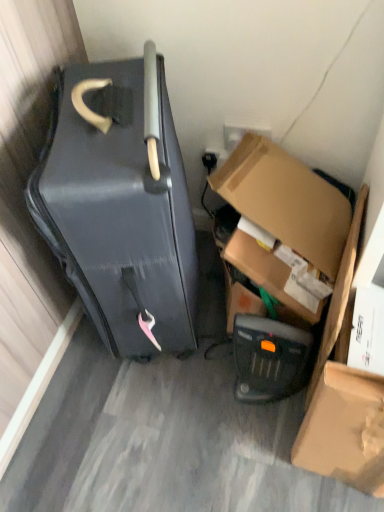
Find the location of a particular element. The image size is (384, 512). matte brown cardboard box at lower right is located at coordinates (341, 429).

You are a GUI agent. You are given a task and a screenshot of the screen. Output one action in this format:
    pyautogui.click(x=<x>, y=<y>)
    Task: Click on the cardboard box at lower right
    The height and width of the screenshot is (512, 384).
    Given the screenshot: What is the action you would take?
    pyautogui.click(x=286, y=200)

Image resolution: width=384 pixels, height=512 pixels. Describe the element at coordinates (286, 200) in the screenshot. I see `cardboard box at lower right` at that location.

You are a GUI agent. You are given a task and a screenshot of the screen. Output one action in this format:
    pyautogui.click(x=<x>, y=<y>)
    Task: Click on the matte black suitcase at left
    The height and width of the screenshot is (512, 384).
    Given the screenshot: What is the action you would take?
    pyautogui.click(x=120, y=205)

From a real-world perspective, is matte brown cardboard box at lower right above or below cardboard box at lower right?

From a real-world perspective, matte brown cardboard box at lower right is physically below cardboard box at lower right.

Is matte brown cardboard box at lower right positioned before cardboard box at lower right?

Yes.

How different are the orientations of matte brown cardboard box at lower right and cardboard box at lower right in degrees?

1.91 degrees.

You are a GUI agent. You are given a task and a screenshot of the screen. Output one action in this format:
    pyautogui.click(x=<x>, y=<y>)
    Task: Click on the cardboard box located in front of the cardboard box at lower right
    This screenshot has height=512, width=384.
    Given the screenshot: What is the action you would take?
    pyautogui.click(x=341, y=429)

From a real-world perspective, who is located higher, cardboard box at lower right or matte brown cardboard box at lower right?

In real-world perspective, cardboard box at lower right is above.

In the image, is cardboard box at lower right positioned in front of or behind matte brown cardboard box at lower right?

cardboard box at lower right is positioned farther from the viewer than matte brown cardboard box at lower right.

Would you say cardboard box at lower right contains matte brown cardboard box at lower right?

No, matte brown cardboard box at lower right is not surrounded by cardboard box at lower right.

Considering the relative sizes of cardboard box at lower right and matte brown cardboard box at lower right in the image provided, is cardboard box at lower right bigger than matte brown cardboard box at lower right?

Correct, cardboard box at lower right is larger in size than matte brown cardboard box at lower right.

From a real-world perspective, between matte brown cardboard box at lower right and matte black suitcase at left, who is vertically higher?

matte black suitcase at left.

Consider the image. From the image's perspective, is matte brown cardboard box at lower right positioned above or below matte black suitcase at left?

Based on their image positions, matte brown cardboard box at lower right is located beneath matte black suitcase at left.

Is matte brown cardboard box at lower right taller than matte black suitcase at left?

In fact, matte brown cardboard box at lower right may be shorter than matte black suitcase at left.

Does matte brown cardboard box at lower right appear on the right side of matte black suitcase at left?

Indeed, matte brown cardboard box at lower right is positioned on the right side of matte black suitcase at left.

Is matte brown cardboard box at lower right aimed at black plastic heater at lower center?

No, matte brown cardboard box at lower right is not oriented towards black plastic heater at lower center.

Does point (311, 400) appear closer or farther from the camera than point (290, 383)?

Point (311, 400) appears to be closer to the viewer than point (290, 383).

Considering the positions of objects matte brown cardboard box at lower right and black plastic heater at lower center in the image provided, who is more to the left, matte brown cardboard box at lower right or black plastic heater at lower center?

Positioned to the left is black plastic heater at lower center.

Identify the location of appliance on the left side of matte brown cardboard box at lower right. This screenshot has height=512, width=384. (269, 358).

Would you say matte black suitcase at left is to the left or to the right of cardboard box at lower right in the picture?

From the image, it's evident that matte black suitcase at left is to the left of cardboard box at lower right.

Is matte black suitcase at left not near cardboard box at lower right?

They are positioned close to each other.

How different are the orientations of matte black suitcase at left and cardboard box at lower right in degrees?

The angle between the facing direction of matte black suitcase at left and the facing direction of cardboard box at lower right is 110 degrees.

From the image's perspective, which is below, matte black suitcase at left or cardboard box at lower right?

cardboard box at lower right, from the image's perspective.

This screenshot has width=384, height=512. Identify the location of box that is behind the matte black suitcase at left. (286, 200).

How different are the orientations of cardboard box at lower right and matte black suitcase at left in degrees?

There is a 110-degree angle between the facing directions of cardboard box at lower right and matte black suitcase at left.

Does cardboard box at lower right appear on the right side of matte black suitcase at left?

Yes.

Considering the sizes of cardboard box at lower right and matte black suitcase at left in the image, is cardboard box at lower right taller or shorter than matte black suitcase at left?

cardboard box at lower right is shorter than matte black suitcase at left.

Does black plastic heater at lower center appear on the right side of matte brown cardboard box at lower right?

No.

Looking at this image, considering the relative sizes of black plastic heater at lower center and matte brown cardboard box at lower right in the image provided, is black plastic heater at lower center taller than matte brown cardboard box at lower right?

Incorrect, the height of black plastic heater at lower center is not larger of that of matte brown cardboard box at lower right.

Locate an element on the screen. This screenshot has width=384, height=512. cardboard box that is on the right side of cardboard box at lower right is located at coordinates (341, 429).

In the image, there is a cardboard box at lower right. In order to click on cardboard box below it (from a real-world perspective) in this screenshot , I will do `click(341, 429)`.

When comparing their distances from cardboard box at lower right, does matte black suitcase at left or black plastic heater at lower center seem closer?

Based on the image, black plastic heater at lower center appears to be nearer to cardboard box at lower right.

When comparing their distances from black plastic heater at lower center, does matte brown cardboard box at lower right or cardboard box at lower right seem closer?

Based on the image, matte brown cardboard box at lower right appears to be nearer to black plastic heater at lower center.

Which object lies nearer to the anchor point matte brown cardboard box at lower right, black plastic heater at lower center or matte black suitcase at left?

Among the two, black plastic heater at lower center is located nearer to matte brown cardboard box at lower right.

When comparing their distances from matte black suitcase at left, does matte brown cardboard box at lower right or cardboard box at lower right seem further?

matte brown cardboard box at lower right.

Based on their spatial positions, is matte black suitcase at left or black plastic heater at lower center further from matte brown cardboard box at lower right?

matte black suitcase at left is positioned further to the anchor matte brown cardboard box at lower right.

Consider the image. Considering their positions, is matte black suitcase at left positioned further to matte brown cardboard box at lower right than cardboard box at lower right?

Based on the image, matte black suitcase at left appears to be further to matte brown cardboard box at lower right.

Considering their positions, is black plastic heater at lower center positioned further to matte black suitcase at left than matte brown cardboard box at lower right?

Based on the image, matte brown cardboard box at lower right appears to be further to matte black suitcase at left.

Estimate the real-world distances between objects in this image. Which object is further from black plastic heater at lower center, cardboard box at lower right or matte black suitcase at left?

The object further to black plastic heater at lower center is matte black suitcase at left.

Locate an element on the screen. appliance between matte black suitcase at left and matte brown cardboard box at lower right is located at coordinates (269, 358).

The height and width of the screenshot is (512, 384). What are the coordinates of `appliance situated between matte black suitcase at left and cardboard box at lower right from left to right` in the screenshot? It's located at (269, 358).

Where is `appliance between cardboard box at lower right and matte brown cardboard box at lower right vertically`? The height and width of the screenshot is (512, 384). appliance between cardboard box at lower right and matte brown cardboard box at lower right vertically is located at coordinates (269, 358).

This screenshot has height=512, width=384. Find the location of `box between matte black suitcase at left and matte brown cardboard box at lower right vertically`. box between matte black suitcase at left and matte brown cardboard box at lower right vertically is located at coordinates (286, 200).